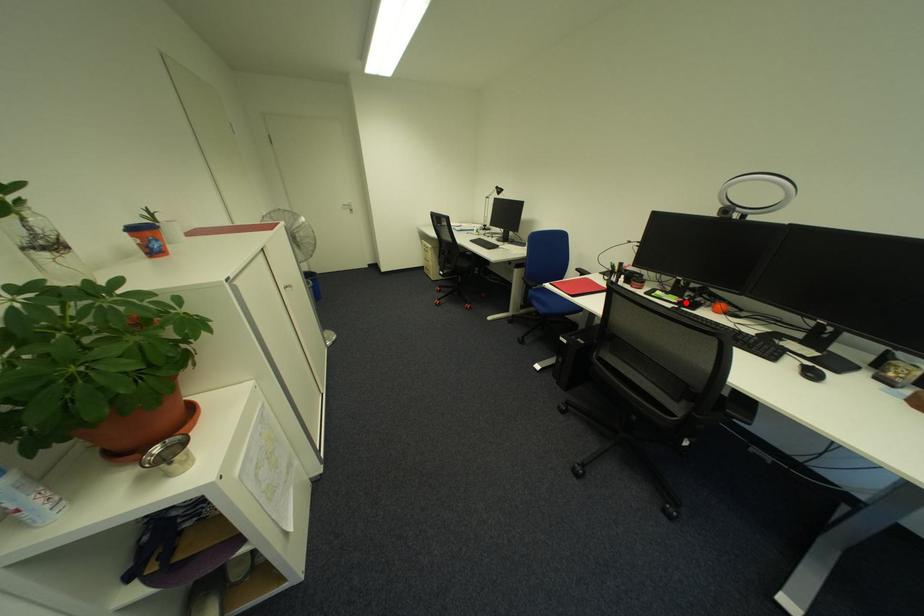
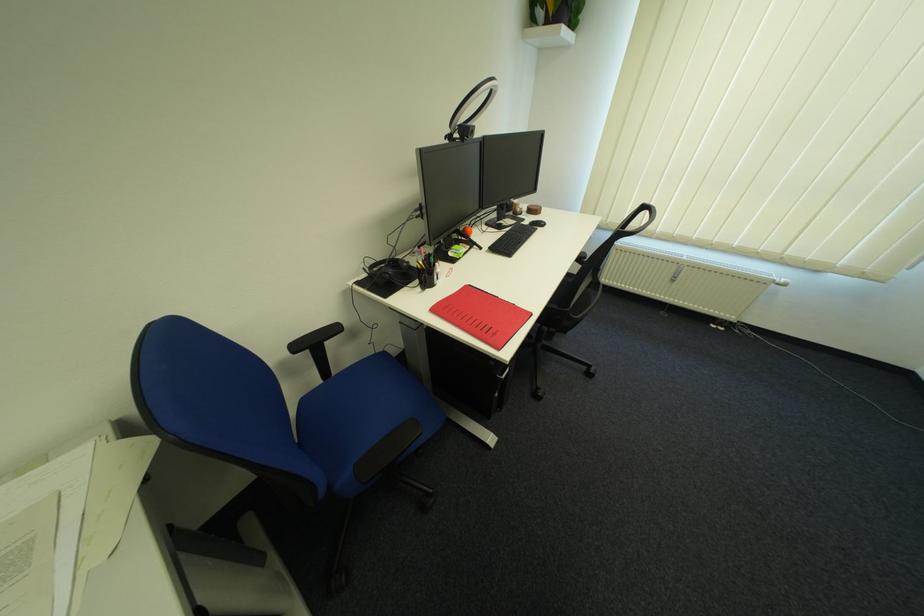
In the second image, find the point that corresponds to the highlighted location in the first image.

(479, 248)